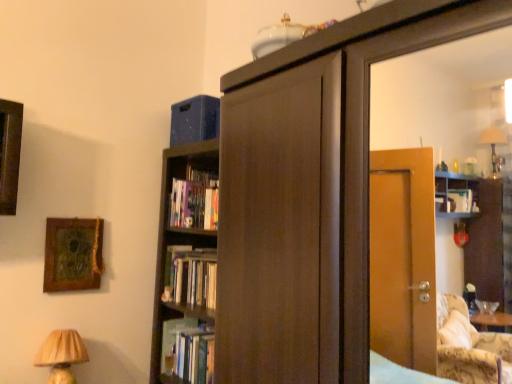
Question: Does hardcover book at center, which appears as the 1th book when ordered from the bottom, have a lesser width compared to wooden textured picture frame at upper left?

Choices:
 (A) no
 (B) yes

Answer: (A)

Question: From a real-world perspective, is hardcover book at center, which appears as the 1th book when ordered from the bottom, positioned over wooden textured picture frame at upper left based on gravity?

Choices:
 (A) no
 (B) yes

Answer: (A)

Question: Is hardcover book at center, the second book from the top, located outside wooden textured picture frame at upper left?

Choices:
 (A) no
 (B) yes

Answer: (B)

Question: Is hardcover book at center, which appears as the 1th book when ordered from the bottom, wider than wooden textured picture frame at upper left?

Choices:
 (A) no
 (B) yes

Answer: (B)

Question: From a real-world perspective, does hardcover book at center, which appears as the 1th book when ordered from the bottom, sit lower than wooden textured picture frame at upper left?

Choices:
 (A) no
 (B) yes

Answer: (B)

Question: In the image, is hardcover book at center, the second book from the top, on the left side or the right side of wooden textured picture frame at upper left?

Choices:
 (A) right
 (B) left

Answer: (A)

Question: From the image's perspective, is hardcover book at center, the second book from the top, above or below wooden textured picture frame at upper left?

Choices:
 (A) above
 (B) below

Answer: (B)

Question: From a real-world perspective, relative to wooden textured picture frame at upper left, is hardcover book at center, which appears as the 1th book when ordered from the bottom, vertically above or below?

Choices:
 (A) above
 (B) below

Answer: (B)

Question: From their relative heights in the image, would you say hardcover book at center, which appears as the 1th book when ordered from the bottom, is taller or shorter than wooden textured picture frame at upper left?

Choices:
 (A) tall
 (B) short

Answer: (B)

Question: Is point (53, 261) positioned closer to the camera than point (200, 377)?

Choices:
 (A) farther
 (B) closer

Answer: (B)

Question: In terms of height, does wooden textured picture frame at upper left look taller or shorter compared to hardcover book at center, which appears as the 1th book when ordered from the bottom?

Choices:
 (A) tall
 (B) short

Answer: (A)

Question: From the image's perspective, is wooden textured picture frame at upper left above or below hardcover book at center, the second book from the top?

Choices:
 (A) below
 (B) above

Answer: (B)

Question: Would you say wooden textured picture frame at upper left is to the left or to the right of hardcover book at center, which appears as the 1th book when ordered from the bottom, in the picture?

Choices:
 (A) right
 (B) left

Answer: (B)

Question: Looking at their shapes, would you say beige pleated lampshade at lower left is wider or thinner than hardcover book at center, acting as the 2th book starting from the bottom?

Choices:
 (A) thin
 (B) wide

Answer: (B)

Question: Is beige pleated lampshade at lower left bigger or smaller than hardcover book at center, acting as the 2th book starting from the bottom?

Choices:
 (A) small
 (B) big

Answer: (B)